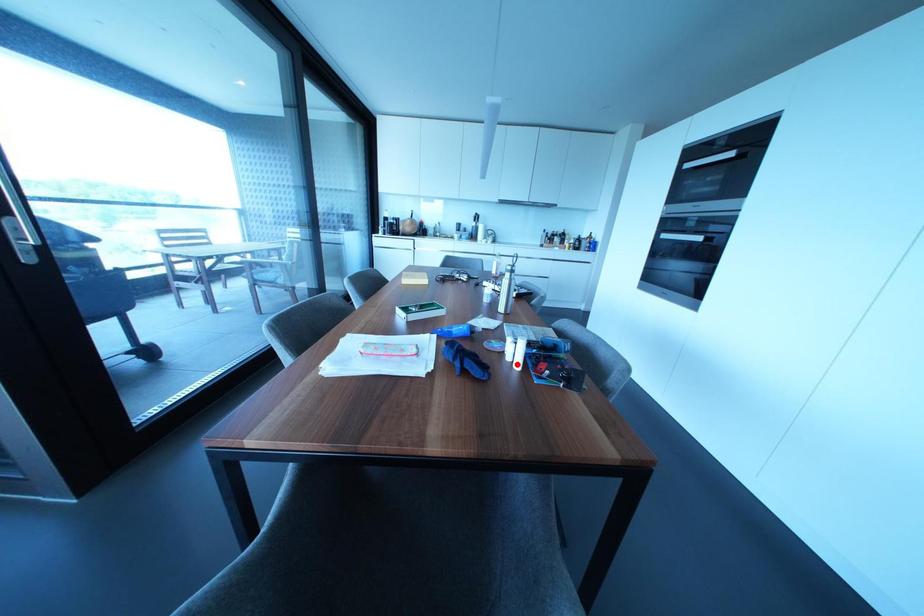
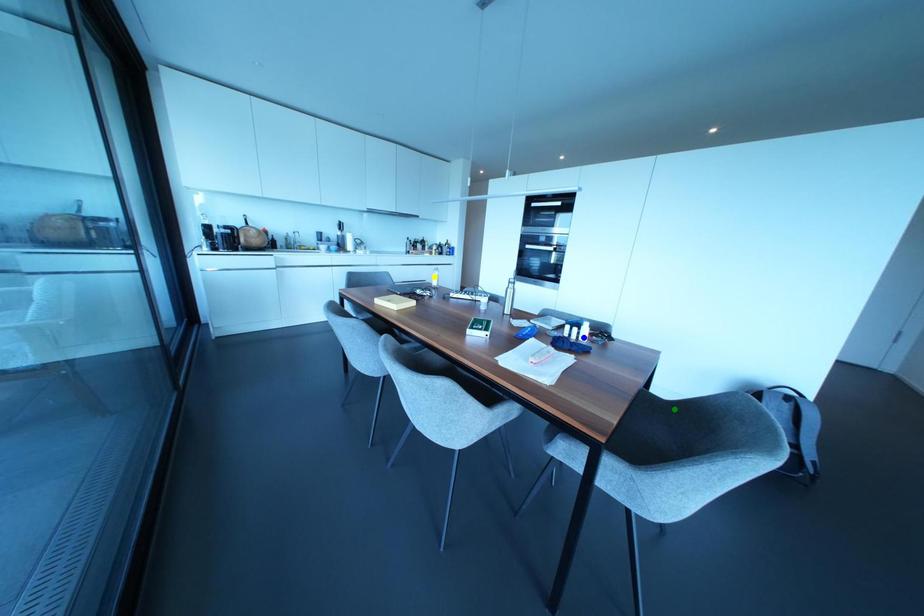
Question: I am providing you with two images of the same scene from different viewpoints. A red point is marked on the first image. You are given multiple points on the second image. Can you choose the point in image 2 that corresponds to the point in image 1?

Choices:
 (A) yellow point
 (B) blue point
 (C) green point

Answer: (B)